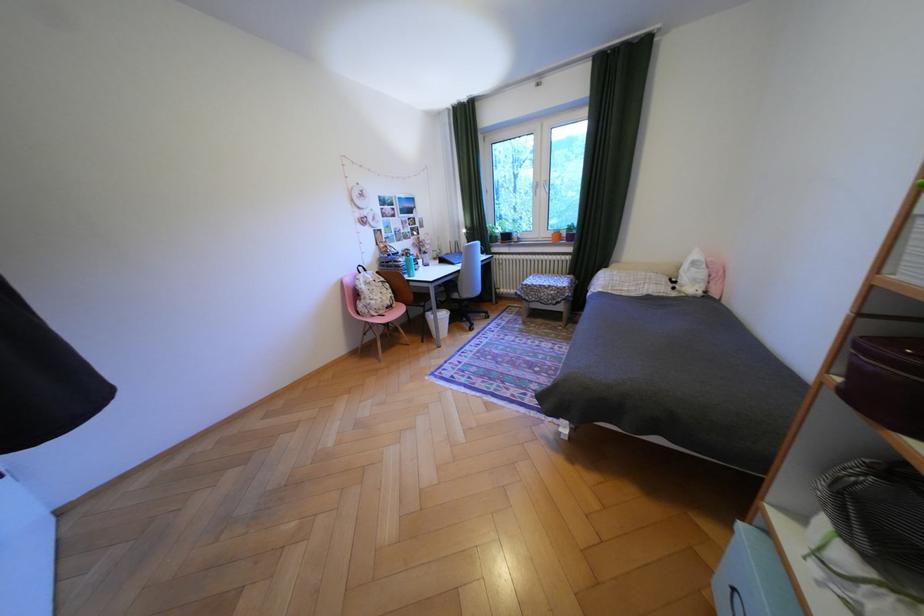
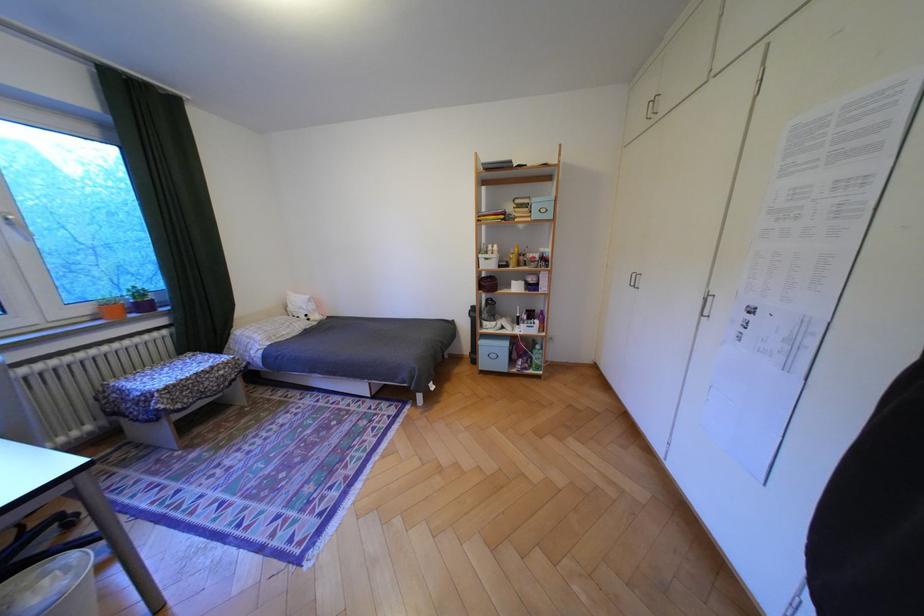
Locate, in the second image, the point that corresponds to [582,237] in the first image.

(155, 307)